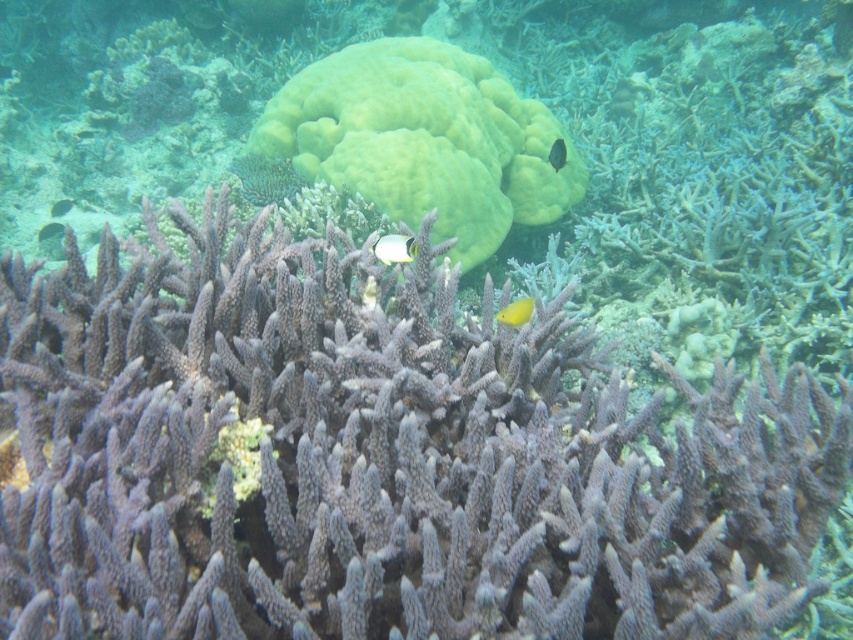
You are a marine biologist observing this underwater scene. You need to place a 3 meter long measuring tape between the green matte coral at center and the translucent yellow fish at center. Will the measuring tape be long enough to reach both ends?

The distance between the green matte coral at center and the translucent yellow fish at center is 2.77 meters. Since the measuring tape is 3 meters long, it will be long enough to reach both ends.